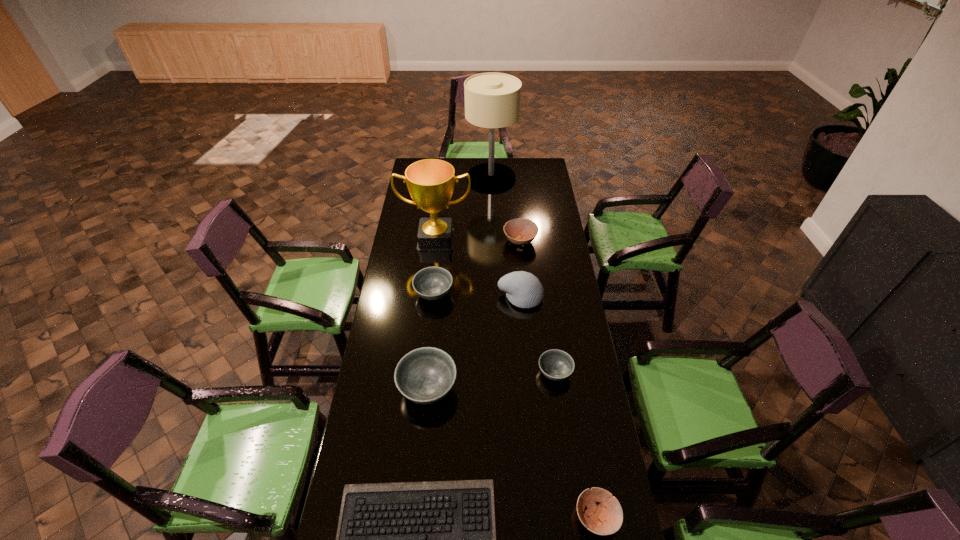
You are a GUI agent. You are given a task and a screenshot of the screen. Output one action in this format:
    pyautogui.click(x=<x>, y=<y>)
    Task: Click on the farthest object
    The image size is (960, 540).
    Given the screenshot: What is the action you would take?
    pyautogui.click(x=492, y=100)

The image size is (960, 540). Identify the location of the tallest object. (492, 100).

At what (x,y) coordinates should I click in order to perform the action: click on award. Please return your answer as a coordinate pair (x, y). Image resolution: width=960 pixels, height=540 pixels. Looking at the image, I should click on (430, 182).

This screenshot has height=540, width=960. I want to click on the eighth shortest object, so click(430, 182).

This screenshot has width=960, height=540. What are the coordinates of `gray beanie` in the screenshot? It's located at (523, 289).

What are the coordinates of `the tallest bowl` in the screenshot? It's located at (425, 375).

Where is `the sixth shortest object`? Image resolution: width=960 pixels, height=540 pixels. the sixth shortest object is located at coordinates (425, 375).

The height and width of the screenshot is (540, 960). I want to click on the farthest gray bowl, so click(x=432, y=283).

At what (x,y) coordinates should I click in order to perform the action: click on the second farthest bowl. Please return your answer as a coordinate pair (x, y). Image resolution: width=960 pixels, height=540 pixels. Looking at the image, I should click on (432, 283).

You are a GUI agent. You are given a task and a screenshot of the screen. Output one action in this format:
    pyautogui.click(x=<x>, y=<y>)
    Task: Click on the bigger brown bowl
    The width and height of the screenshot is (960, 540).
    Given the screenshot: What is the action you would take?
    pyautogui.click(x=521, y=231)